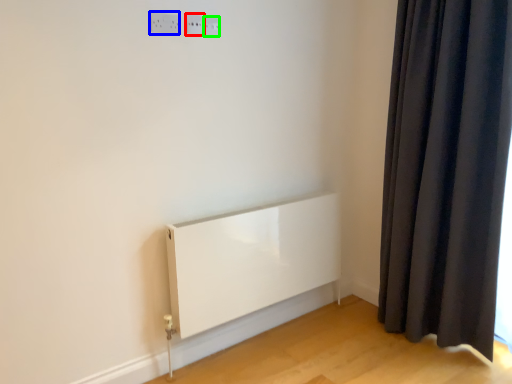
Question: Which is farther away from electric outlet (highlighted by a red box)? electric outlet (highlighted by a blue box) or electric outlet (highlighted by a green box)?

Choices:
 (A) electric outlet
 (B) electric outlet

Answer: (A)